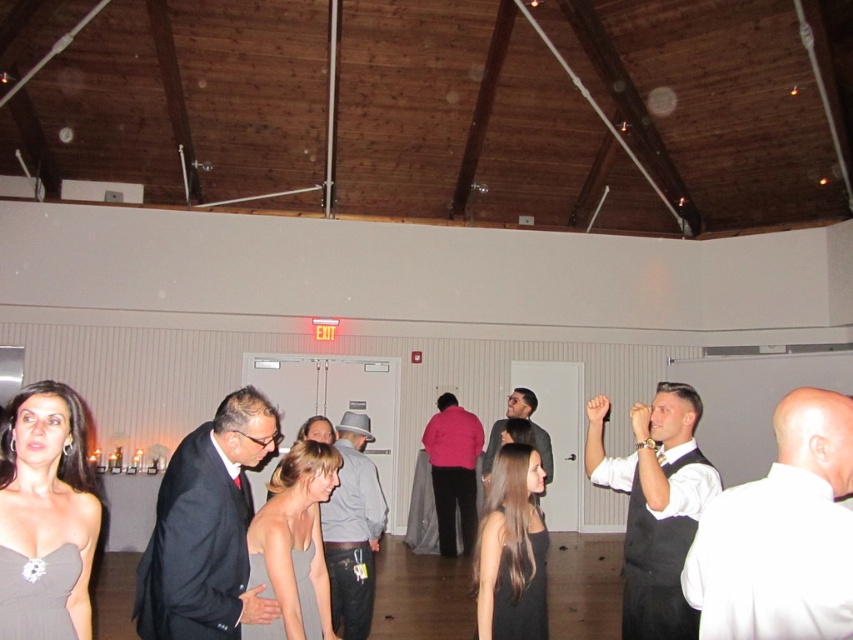
Can you confirm if matte black dress at center is thinner than denim jeans at center?

Correct, matte black dress at center's width is less than denim jeans at center's.

Who is positioned more to the right, matte black dress at center or denim jeans at center?

denim jeans at center is more to the right.

Where is `matte black dress at center`? The image size is (853, 640). matte black dress at center is located at coordinates (294, 545).

Which is more to the left, denim jeans at center or matte black dress at lower center?

matte black dress at lower center

Is point (357, 572) farther from camera compared to point (248, 545)?

That is True.

The image size is (853, 640). Find the location of `denim jeans at center`. denim jeans at center is located at coordinates (352, 529).

The height and width of the screenshot is (640, 853). I want to click on white satin vest at right, so click(781, 534).

Between white satin vest at right and matte black dress at center, which one appears on the right side from the viewer's perspective?

Positioned to the right is white satin vest at right.

Which is in front, point (750, 561) or point (305, 618)?

Point (750, 561) is more forward.

Identify the location of white satin vest at right. (781, 534).